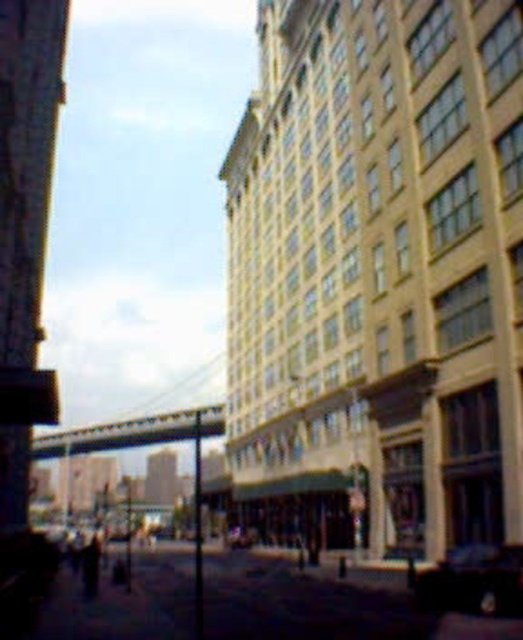
Who is more distant from viewer, (437,580) or (243,536)?

Point (243,536)

Which is behind, point (515, 545) or point (242, 531)?

Point (242, 531)

You are a GUI agent. You are given a task and a screenshot of the screen. Output one action in this format:
    pyautogui.click(x=<x>, y=<y>)
    Task: Click on the shiny black car at lower right
    The image size is (523, 640).
    Given the screenshot: What is the action you would take?
    pyautogui.click(x=474, y=580)